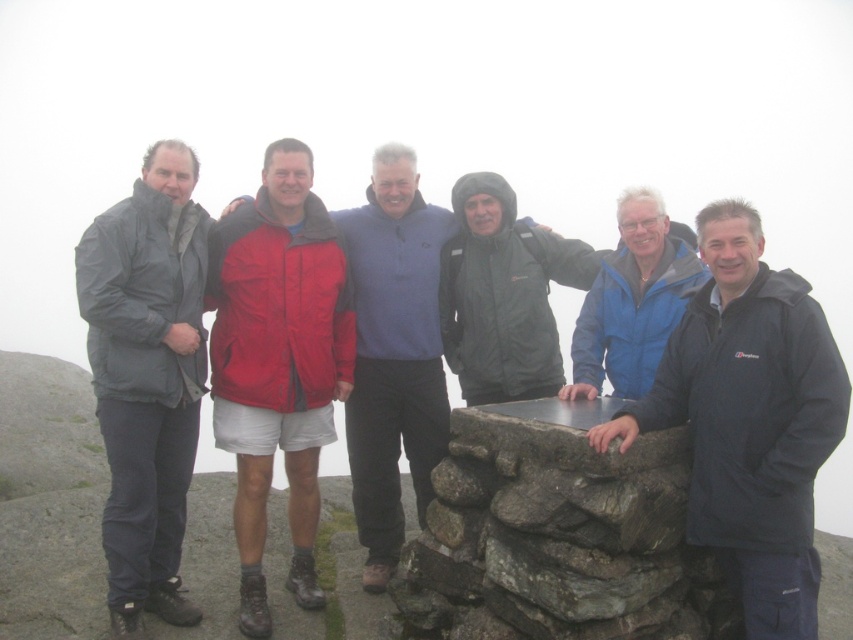
Is point (695, 410) closer to viewer compared to point (216, 262)?

That is True.

Is dark blue jacket at center thinner than red fabric jacket at center?

Incorrect, dark blue jacket at center's width is not less than red fabric jacket at center's.

You are a GUI agent. You are given a task and a screenshot of the screen. Output one action in this format:
    pyautogui.click(x=<x>, y=<y>)
    Task: Click on the dark blue jacket at center
    
    Given the screenshot: What is the action you would take?
    pyautogui.click(x=749, y=420)

Locate an element on the screen. The height and width of the screenshot is (640, 853). dark blue jacket at center is located at coordinates (749, 420).

Does matte gray jacket at left have a smaller size compared to blue matte jacket at center?

No, matte gray jacket at left is not smaller than blue matte jacket at center.

Which of these two, matte gray jacket at left or blue matte jacket at center, stands taller?

matte gray jacket at left is taller.

Who is more forward, (112, 280) or (573, 333)?

Point (112, 280) is more forward.

The image size is (853, 640). Find the location of `matte gray jacket at left`. matte gray jacket at left is located at coordinates (148, 378).

This screenshot has height=640, width=853. What do you see at coordinates (277, 362) in the screenshot? I see `red fabric jacket at center` at bounding box center [277, 362].

Which is above, red fabric jacket at center or matte black jacket at center?

matte black jacket at center is higher up.

Does point (231, 220) lie behind point (461, 196)?

No, it is in front of (461, 196).

Where is `red fabric jacket at center`? red fabric jacket at center is located at coordinates (277, 362).